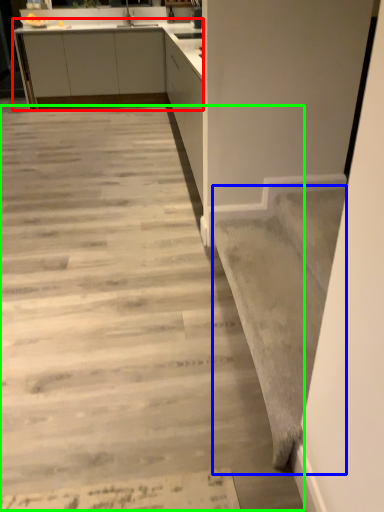
Question: Based on their relative distances, which object is nearer to cabinetry (highlighted by a red box)? Choose from stairwell (highlighted by a blue box) and concrete (highlighted by a green box).

Choices:
 (A) stairwell
 (B) concrete

Answer: (B)